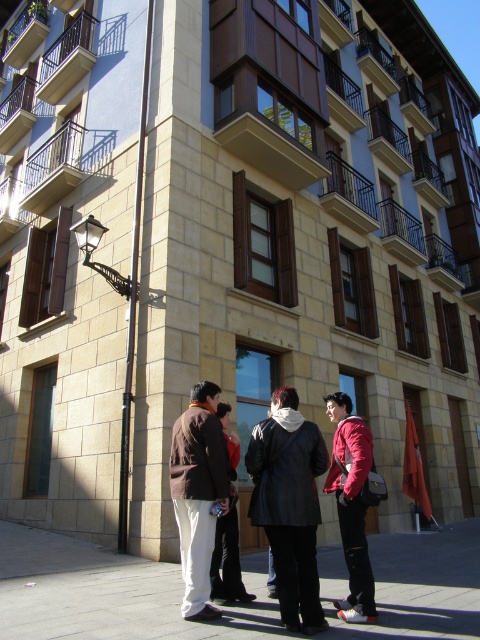
Question: Can you confirm if brown leather jacket at center is positioned to the right of black leather jacket at center?

Choices:
 (A) yes
 (B) no

Answer: (B)

Question: Among these points, which one is nearest to the camera?

Choices:
 (A) coord(315,600)
 (B) coord(369,436)

Answer: (A)

Question: Can you confirm if matte red jacket at center is positioned below black leather jacket at center?

Choices:
 (A) no
 (B) yes

Answer: (A)

Question: Which is farther from the leather jacket at center?

Choices:
 (A) brown leather jacket at center
 (B) black leather jacket at center

Answer: (B)

Question: Is matte red jacket at center bigger than black leather jacket at center?

Choices:
 (A) yes
 (B) no

Answer: (B)

Question: Which point appears farthest from the camera in this image?

Choices:
 (A) (200, 614)
 (B) (348, 461)
 (C) (302, 589)

Answer: (B)